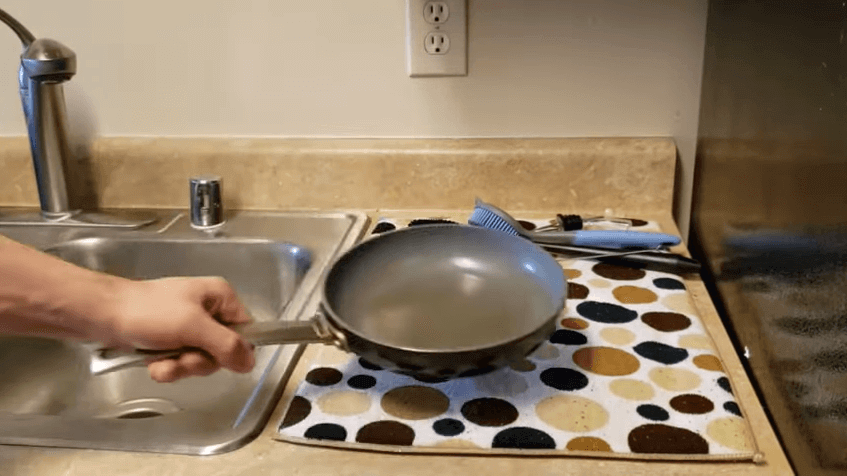
At what (x,y) coordinates should I click in order to perform the action: click on dish drying mat. Please return your answer as a coordinate pair (x, y). Looking at the image, I should click on (663, 416).